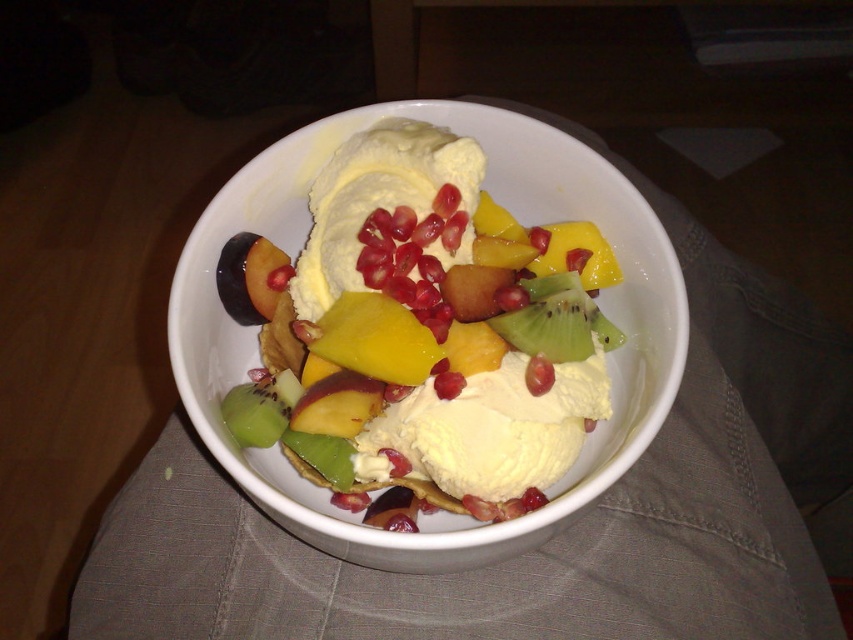
Which is above, green matte kiwi at center or shiny red pomegranate at center?

green matte kiwi at center

Is point (583, 308) in front of point (529, 365)?

No.

What do you see at coordinates (549, 324) in the screenshot? I see `green matte kiwi at center` at bounding box center [549, 324].

This screenshot has height=640, width=853. In order to click on green matte kiwi at center in this screenshot , I will do `click(549, 324)`.

Is smooth creamy ice cream at center to the right of shiny red pomegranate at center from the viewer's perspective?

Incorrect, smooth creamy ice cream at center is not on the right side of shiny red pomegranate at center.

Can you confirm if smooth creamy ice cream at center is thinner than shiny red pomegranate at center?

In fact, smooth creamy ice cream at center might be wider than shiny red pomegranate at center.

Identify the location of smooth creamy ice cream at center. This screenshot has height=640, width=853. (413, 330).

Who is taller, green matte kiwi at center or red glossy pomegranate at center?

With more height is green matte kiwi at center.

Does green matte kiwi at center appear on the right side of red glossy pomegranate at center?

Indeed, green matte kiwi at center is positioned on the right side of red glossy pomegranate at center.

Is point (546, 353) less distant than point (451, 380)?

No, (546, 353) is behind (451, 380).

Identify the location of green matte kiwi at center. Image resolution: width=853 pixels, height=640 pixels. (549, 324).